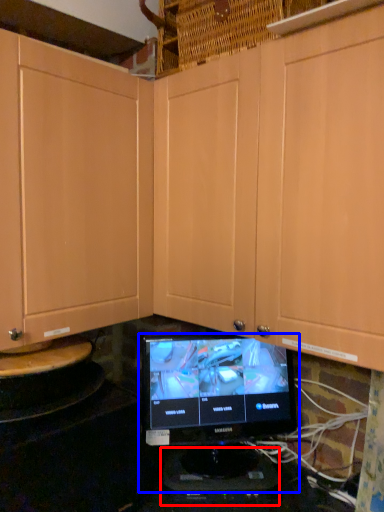
Question: Which point is closer to the camera, appliance (highlighted by a red box) or computer monitor (highlighted by a blue box)?

Choices:
 (A) appliance
 (B) computer monitor

Answer: (B)